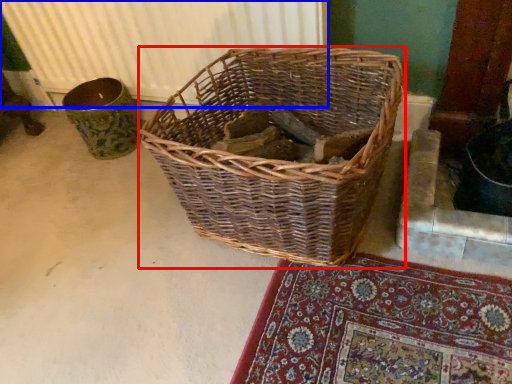
Question: Which object is further to the camera taking this photo, picnic basket (highlighted by a red box) or radiator (highlighted by a blue box)?

Choices:
 (A) picnic basket
 (B) radiator

Answer: (B)